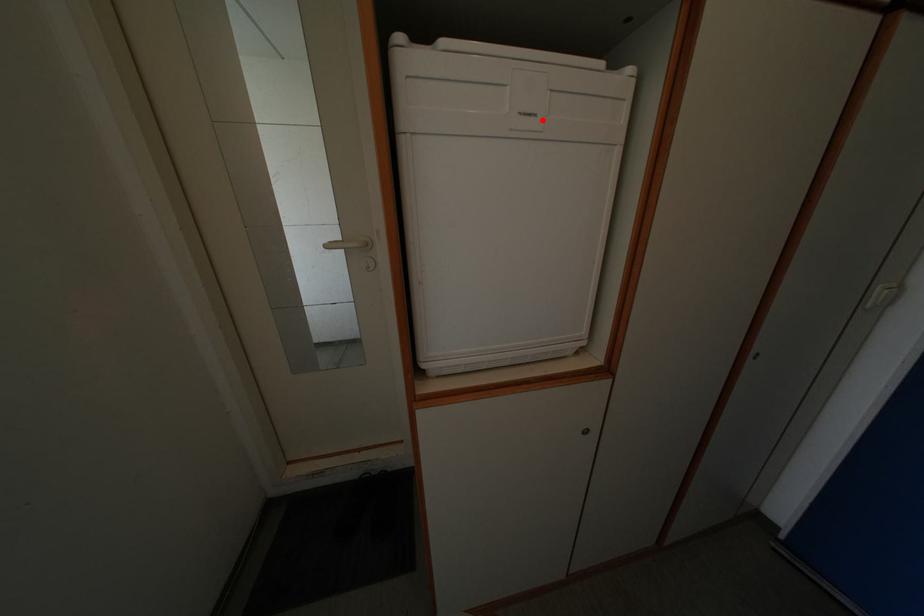
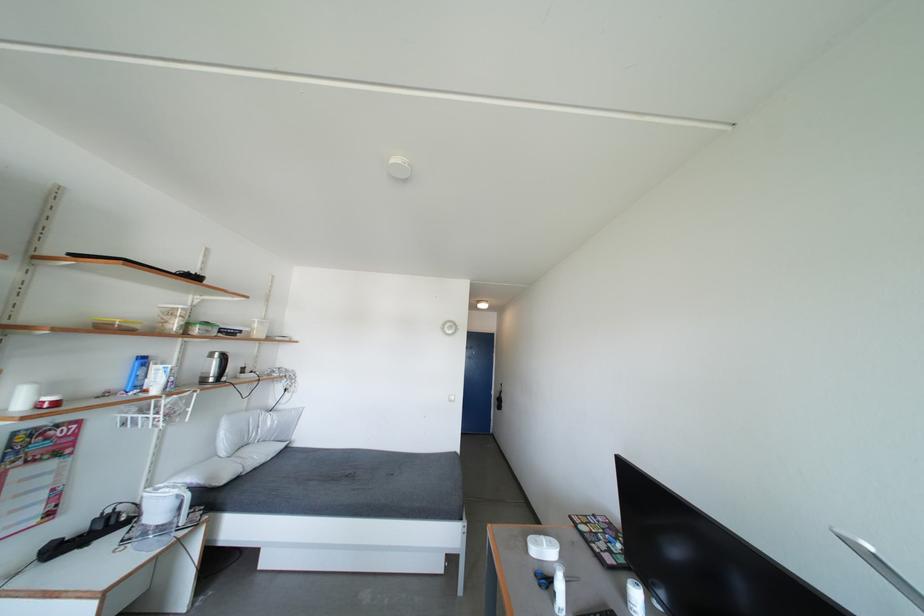
Question: I am providing you with two images of the same scene from different viewpoints. A red point is marked on the first image. Can you still see the location of the red point in image 2?

Choices:
 (A) Yes
 (B) No

Answer: (B)